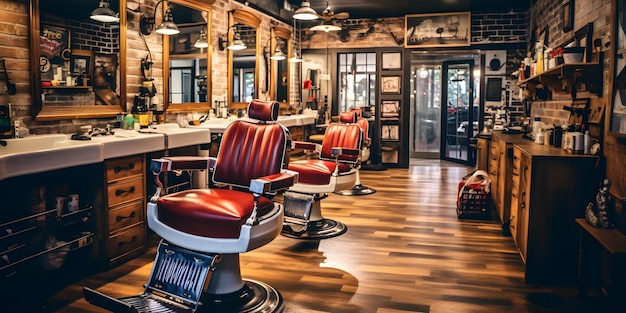
This screenshot has width=626, height=313. Find the location of `chair`. chair is located at coordinates (228, 149), (326, 137), (367, 127).